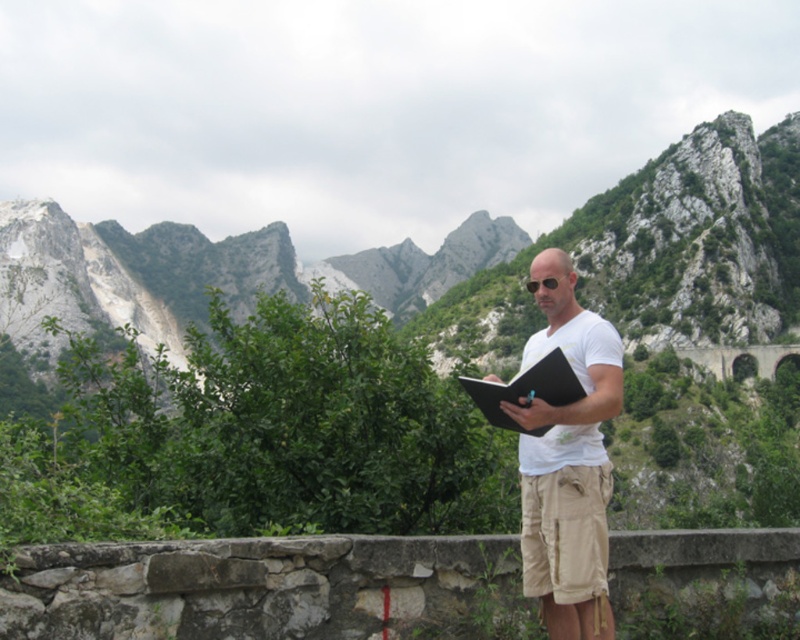
Which is behind, point (74, 289) or point (580, 506)?

Positioned behind is point (74, 289).

Which of these two, rugged stone mountain at center or white cotton shirt at center, stands shorter?

white cotton shirt at center

The image size is (800, 640). Find the location of `rugged stone mountain at center`. rugged stone mountain at center is located at coordinates (622, 253).

Which of these two, rugged stone mountain at center or tan cotton shorts at center, stands shorter?

tan cotton shorts at center

From the picture: Can you confirm if rugged stone mountain at center is positioned above tan cotton shorts at center?

Yes.

Is point (264, 227) closer to camera compared to point (586, 540)?

No, (264, 227) is further to viewer.

Locate an element on the screen. The width and height of the screenshot is (800, 640). rugged stone mountain at center is located at coordinates (622, 253).

Looking at this image, measure the distance between rugged stone mountain at center and black matte notebook at center.

They are 140.66 meters apart.

Is point (644, 227) behind point (482, 410)?

Yes.

The width and height of the screenshot is (800, 640). What do you see at coordinates (622, 253) in the screenshot? I see `rugged stone mountain at center` at bounding box center [622, 253].

At what (x,y) coordinates should I click in order to perform the action: click on rugged stone mountain at center. Please return your answer as a coordinate pair (x, y). The image size is (800, 640). Looking at the image, I should click on pos(622,253).